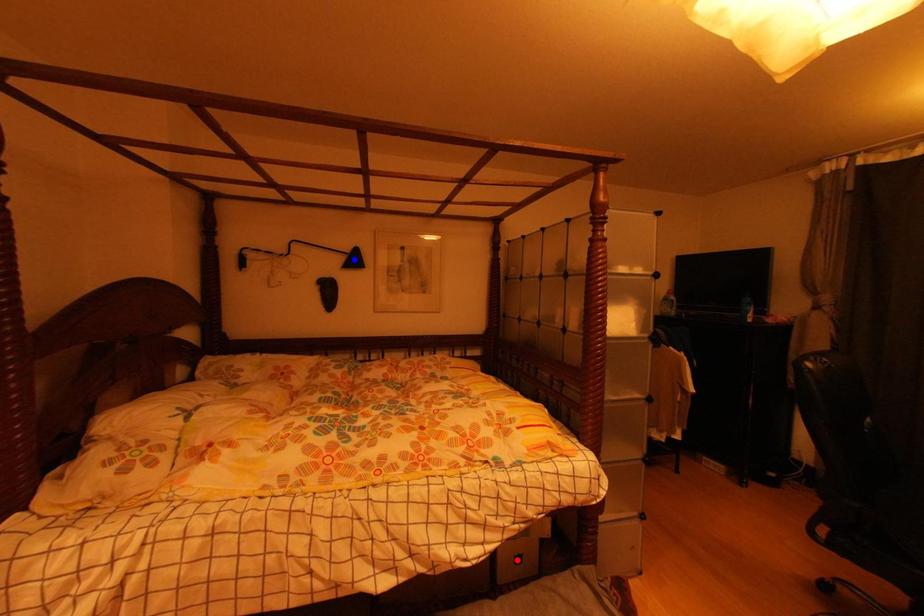
Question: In the image, two points are highlighted. Which point is nearer to the camera? Reply with the corresponding letter.

Choices:
 (A) blue point
 (B) red point

Answer: (B)